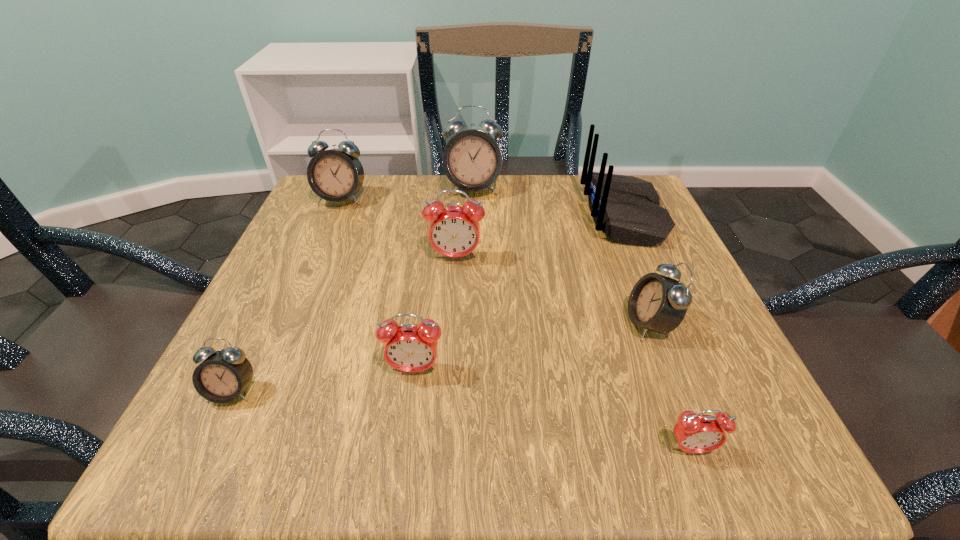
Where is `vacant position in the image that satisfies the following two spatial constraints: 1. on the face of the rightmost white alarm clock; 2. on the face of the nearest object`? The width and height of the screenshot is (960, 540). vacant position in the image that satisfies the following two spatial constraints: 1. on the face of the rightmost white alarm clock; 2. on the face of the nearest object is located at coordinates (697, 449).

What are the coordinates of `free space that satisfies the following two spatial constraints: 1. on the back of the black router; 2. on the face of the rightmost red alarm clock` in the screenshot? It's located at (723, 449).

Where is `vacant region that satisfies the following two spatial constraints: 1. on the back of the black router; 2. on the face of the fourth farthest object`? Image resolution: width=960 pixels, height=540 pixels. vacant region that satisfies the following two spatial constraints: 1. on the back of the black router; 2. on the face of the fourth farthest object is located at coordinates 641,258.